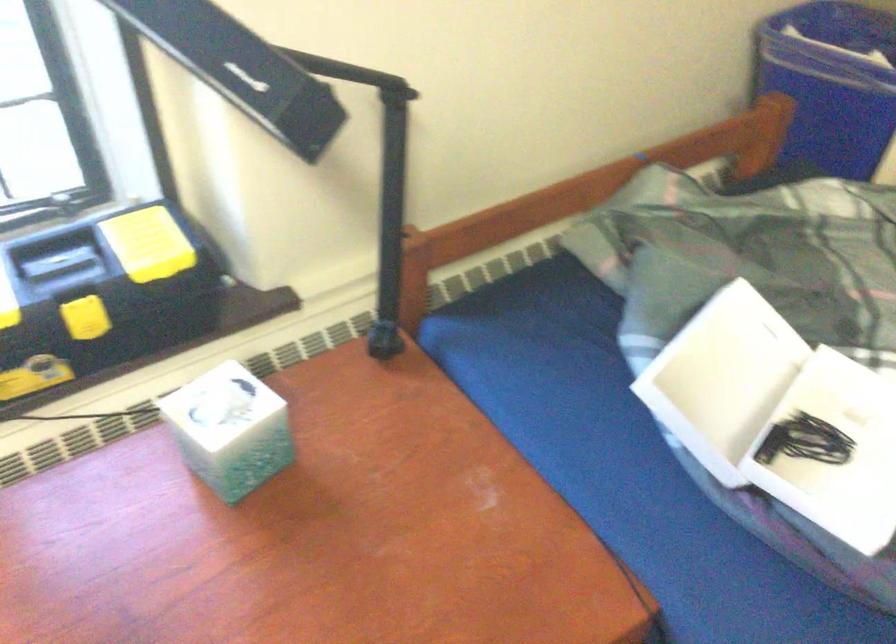
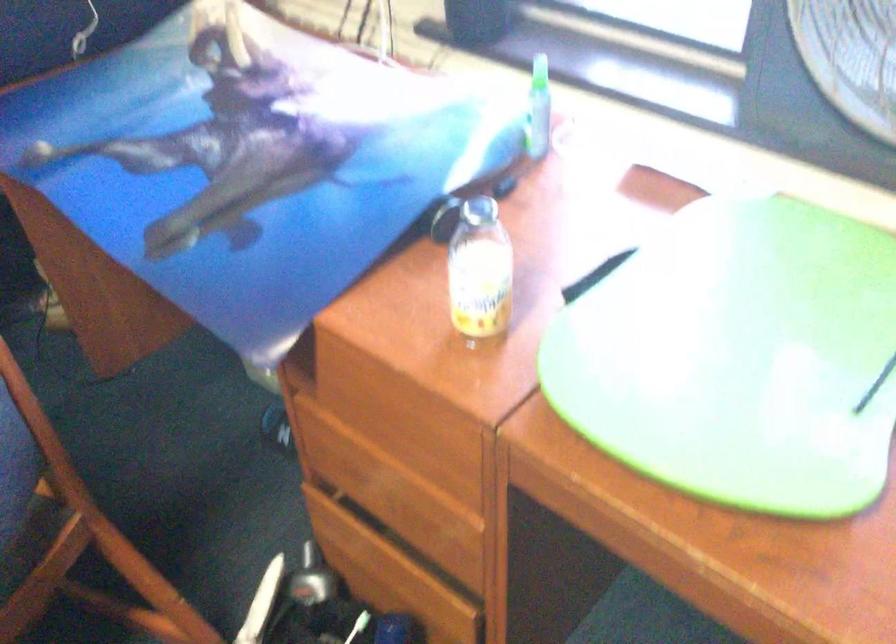
The first image is from the beginning of the video and the second image is from the end. How did the camera likely rotate when shooting the video?

The camera rotated toward left-down.